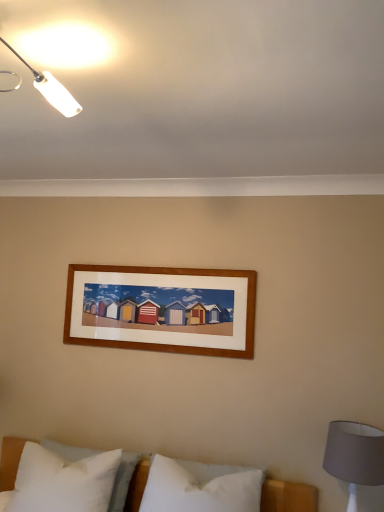
Question: Does gray fabric lampshade at lower right appear on the left side of white soft pillow at center, arranged as the second pillow when viewed from the left?

Choices:
 (A) yes
 (B) no

Answer: (B)

Question: Can you confirm if gray fabric lampshade at lower right is smaller than white soft pillow at center, which is the 1th pillow from right to left?

Choices:
 (A) yes
 (B) no

Answer: (A)

Question: Are gray fabric lampshade at lower right and white soft pillow at center, which is the 1th pillow from right to left, far apart?

Choices:
 (A) yes
 (B) no

Answer: (B)

Question: Can you confirm if gray fabric lampshade at lower right is positioned to the right of white soft pillow at center, arranged as the second pillow when viewed from the left?

Choices:
 (A) no
 (B) yes

Answer: (B)

Question: Is gray fabric lampshade at lower right turned away from white soft pillow at center, which is the 1th pillow from right to left?

Choices:
 (A) yes
 (B) no

Answer: (B)

Question: From the image's perspective, is gray fabric lampshade at lower right located beneath white soft pillow at center, arranged as the second pillow when viewed from the left?

Choices:
 (A) no
 (B) yes

Answer: (A)

Question: Is white plastic lamp at upper left oriented away from white soft pillow at lower left, arranged as the 1th pillow when viewed from the left?

Choices:
 (A) no
 (B) yes

Answer: (A)

Question: From a real-world perspective, does white plastic lamp at upper left stand above white soft pillow at lower left, arranged as the 1th pillow when viewed from the left?

Choices:
 (A) yes
 (B) no

Answer: (A)

Question: Does white plastic lamp at upper left appear on the right side of white soft pillow at lower left, arranged as the 1th pillow when viewed from the left?

Choices:
 (A) yes
 (B) no

Answer: (A)

Question: Does white plastic lamp at upper left have a smaller size compared to white soft pillow at lower left, which is the 2th pillow from right to left?

Choices:
 (A) yes
 (B) no

Answer: (A)

Question: Is white plastic lamp at upper left to the left of white soft pillow at lower left, arranged as the 1th pillow when viewed from the left, from the viewer's perspective?

Choices:
 (A) yes
 (B) no

Answer: (B)

Question: From the image's perspective, is white plastic lamp at upper left located beneath white soft pillow at lower left, arranged as the 1th pillow when viewed from the left?

Choices:
 (A) yes
 (B) no

Answer: (B)

Question: Is white soft pillow at lower left, which is the 2th pillow from right to left, bigger than white plastic lamp at upper left?

Choices:
 (A) yes
 (B) no

Answer: (A)